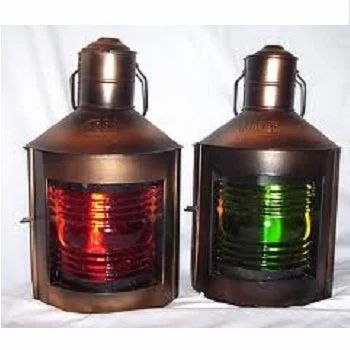
Find the location of a particular element. The width and height of the screenshot is (350, 350). left handle is located at coordinates (74, 94).